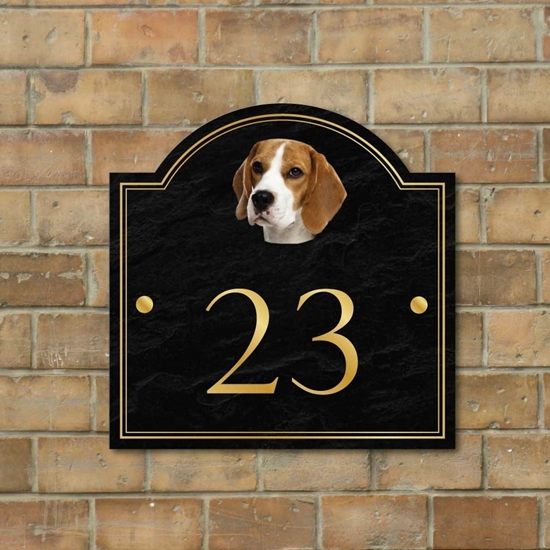
Identify the location of black marble. The image size is (550, 550). (381, 246).